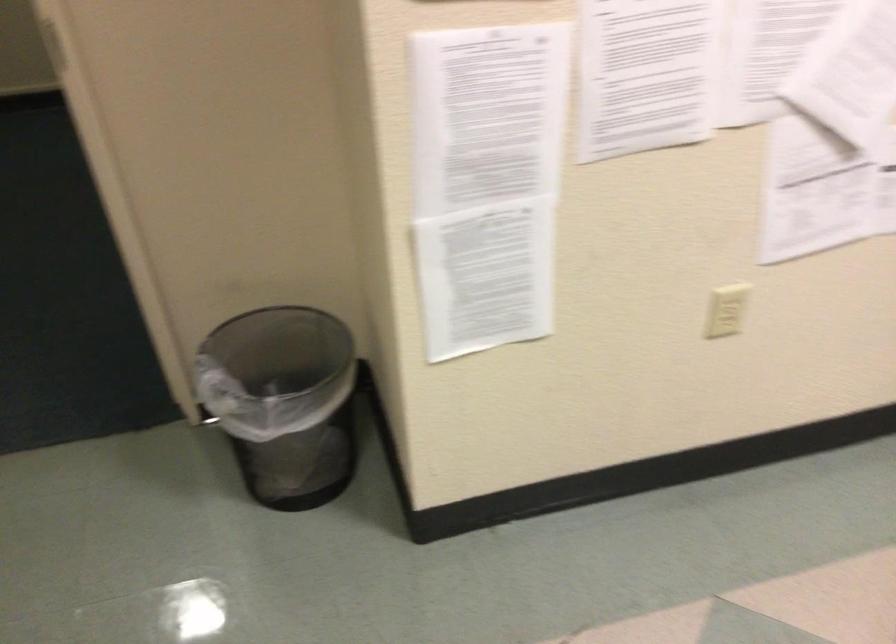
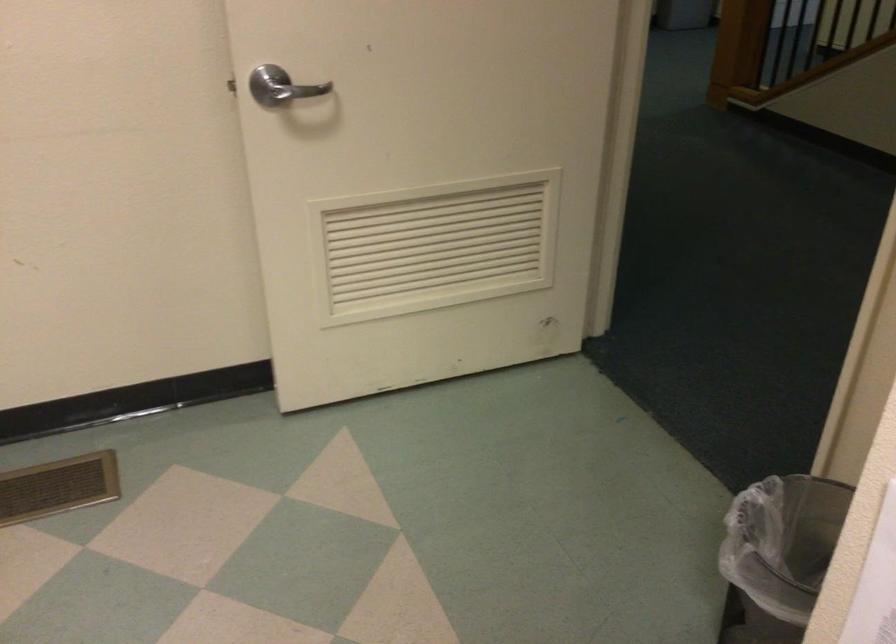
The images are taken continuously from a first-person perspective. In which direction is your viewpoint rotating?

The camera rotated toward left-down.